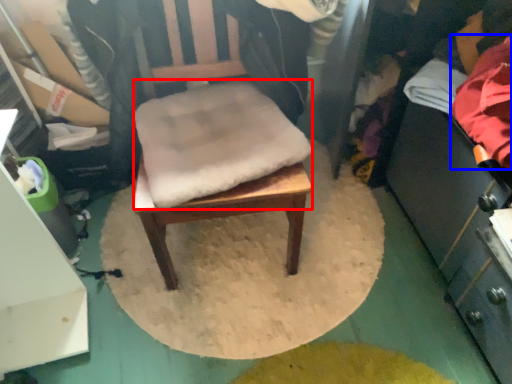
Question: Among these objects, which one is farthest to the camera, footrest (highlighted by a red box) or clothing (highlighted by a blue box)?

Choices:
 (A) footrest
 (B) clothing

Answer: (A)